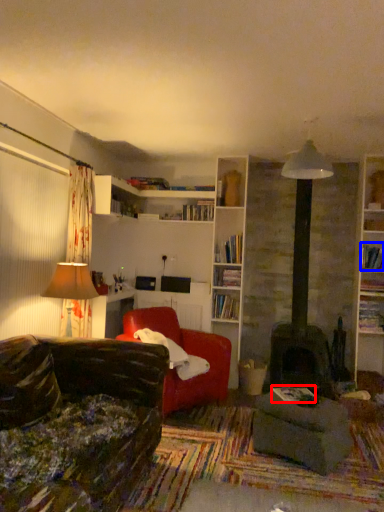
Question: Which object appears farthest to the camera in this image, book (highlighted by a red box) or book (highlighted by a blue box)?

Choices:
 (A) book
 (B) book

Answer: (B)